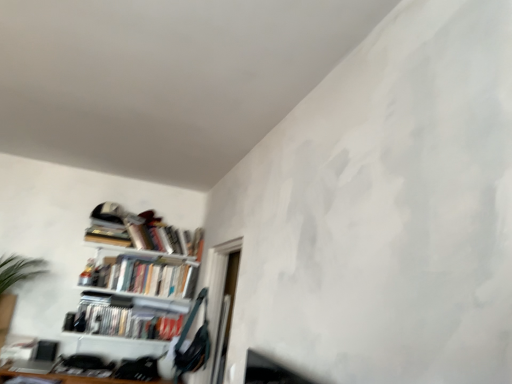
Question: From a real-world perspective, is transparent glass door at center on hardcover books at upper left, which is the 3th book in bottom-to-top order?

Choices:
 (A) no
 (B) yes

Answer: (A)

Question: Is transparent glass door at center not close to hardcover books at upper left, which is the 3th book in bottom-to-top order?

Choices:
 (A) no
 (B) yes

Answer: (A)

Question: From a real-world perspective, is transparent glass door at center positioned under hardcover books at upper left, which appears as the first book when viewed from the top, based on gravity?

Choices:
 (A) yes
 (B) no

Answer: (A)

Question: From the image's perspective, is transparent glass door at center on hardcover books at upper left, which is the 3th book in bottom-to-top order?

Choices:
 (A) no
 (B) yes

Answer: (A)

Question: Is the position of transparent glass door at center less distant than that of hardcover books at upper left, which is the 3th book in bottom-to-top order?

Choices:
 (A) no
 (B) yes

Answer: (B)

Question: Is transparent glass door at center next to hardcover books at upper left, which appears as the first book when viewed from the top, and touching it?

Choices:
 (A) no
 (B) yes

Answer: (A)

Question: Is metallic silver bookshelf at left wider than white glossy bookshelf at lower left, which is counted as the first book, starting from the bottom?

Choices:
 (A) no
 (B) yes

Answer: (B)

Question: Considering the relative sizes of metallic silver bookshelf at left and white glossy bookshelf at lower left, which is counted as the first book, starting from the bottom, in the image provided, is metallic silver bookshelf at left thinner than white glossy bookshelf at lower left, which is counted as the first book, starting from the bottom,?

Choices:
 (A) yes
 (B) no

Answer: (B)

Question: Is metallic silver bookshelf at left not inside white glossy bookshelf at lower left, which is the 3th book in top-to-bottom order?

Choices:
 (A) yes
 (B) no

Answer: (A)

Question: From a real-world perspective, is metallic silver bookshelf at left on white glossy bookshelf at lower left, which is counted as the first book, starting from the bottom?

Choices:
 (A) yes
 (B) no

Answer: (A)

Question: Is metallic silver bookshelf at left far from white glossy bookshelf at lower left, which is counted as the first book, starting from the bottom?

Choices:
 (A) yes
 (B) no

Answer: (B)

Question: Is metallic silver bookshelf at left at the left side of white glossy bookshelf at lower left, which is the 3th book in top-to-bottom order?

Choices:
 (A) no
 (B) yes

Answer: (A)

Question: From the image's perspective, is hardcover books at upper left, which appears as the first book when viewed from the top, above white glossy bookshelf at lower left, which is the 3th book in top-to-bottom order?

Choices:
 (A) yes
 (B) no

Answer: (A)